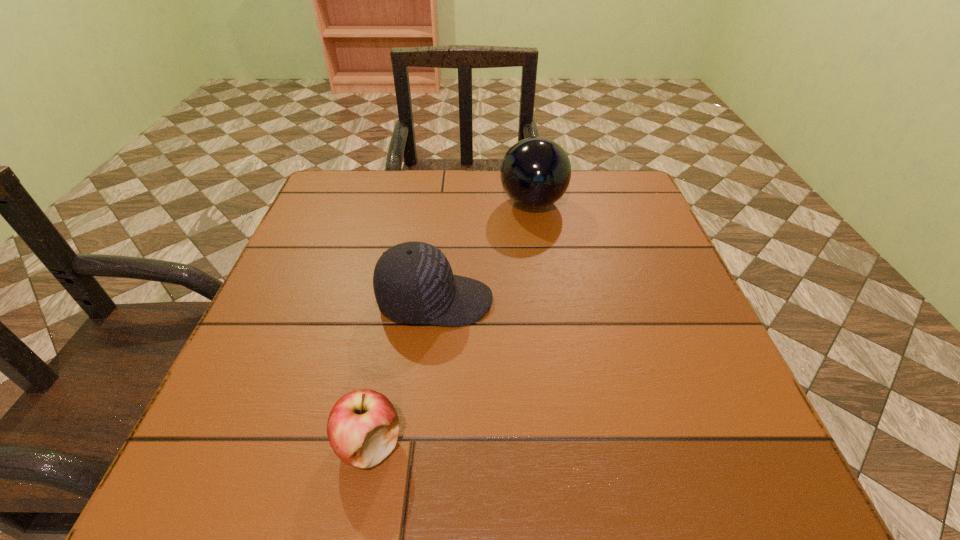
The image size is (960, 540). I want to click on blank space located on the back of the shortest object, so click(390, 339).

Where is `object situated at the far edge`? object situated at the far edge is located at coordinates (535, 173).

Find the location of a particular element. This screenshot has width=960, height=540. object positioned at the near edge is located at coordinates (363, 426).

In the image, there is a desktop. Identify the location of vacant space at the far edge. This screenshot has height=540, width=960. click(x=510, y=215).

In the image, there is a desktop. Identify the location of vacant area at the near edge. (332, 490).

Find the location of a particular element. free point at the left edge is located at coordinates (294, 256).

This screenshot has height=540, width=960. What are the coordinates of `free space at the right edge` in the screenshot? It's located at (711, 364).

The image size is (960, 540). Identify the location of vacant space at the far right corner. click(582, 173).

I want to click on blank space at the near right corner of the desktop, so click(x=727, y=473).

The image size is (960, 540). Find the location of `blank region between the second shortest object and the tallest object`. blank region between the second shortest object and the tallest object is located at coordinates (484, 252).